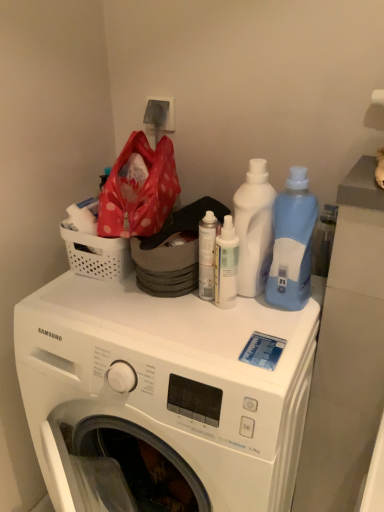
The width and height of the screenshot is (384, 512). I want to click on free spot to the left of white matte spray can at center, so (117, 309).